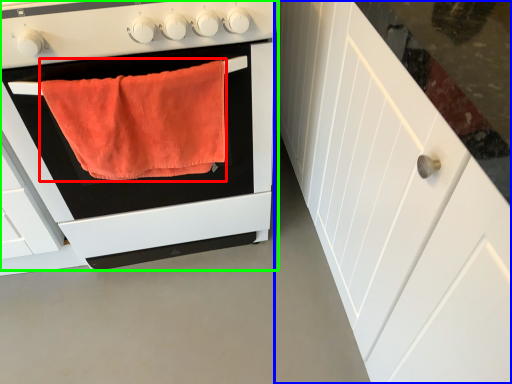
Question: Which object is positioned farthest from bath towel (highlighted by a red box)? Select from cabinetry (highlighted by a blue box) and oven (highlighted by a green box).

Choices:
 (A) cabinetry
 (B) oven

Answer: (A)